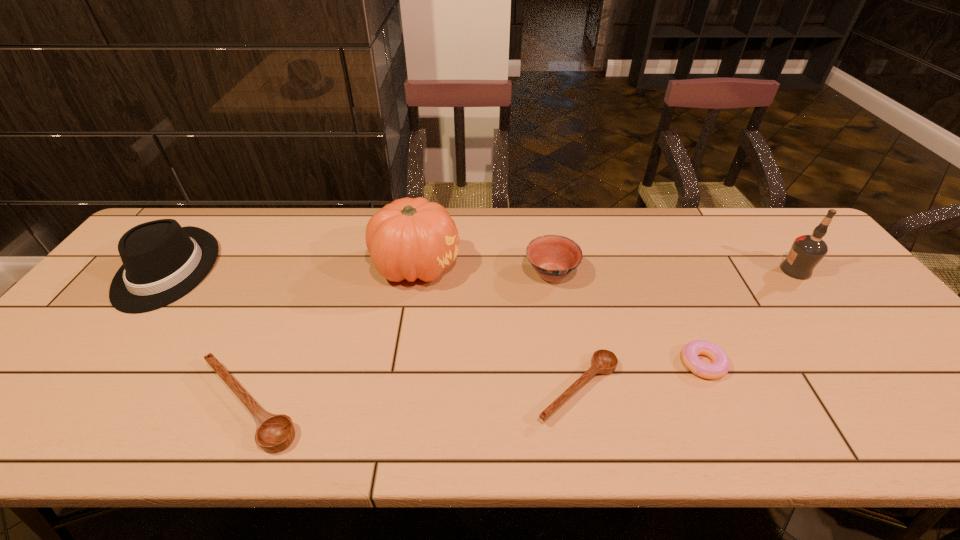
Find the location of a particular element. the third shortest object is located at coordinates (274, 433).

Where is `the taller wooden spoon`? the taller wooden spoon is located at coordinates (274, 433).

Find the location of a particular element. This screenshot has height=540, width=960. the right wooden spoon is located at coordinates (604, 362).

The width and height of the screenshot is (960, 540). What are the coordinates of `vodka` in the screenshot? It's located at (807, 251).

This screenshot has height=540, width=960. Find the location of `fedora`. fedora is located at coordinates (162, 262).

This screenshot has width=960, height=540. I want to click on the fifth shortest object, so click(x=162, y=262).

Identify the location of the fourth tallest object. (553, 257).

Find the location of a particular element. the third object from left to right is located at coordinates (410, 238).

At what (x,y) coordinates should I click in order to perform the action: click on the sixth object from left to right. Please return your answer as a coordinate pair (x, y). The height and width of the screenshot is (540, 960). Looking at the image, I should click on (721, 364).

Locate an element on the screen. The height and width of the screenshot is (540, 960). free location located on the left of the third shortest object is located at coordinates (103, 405).